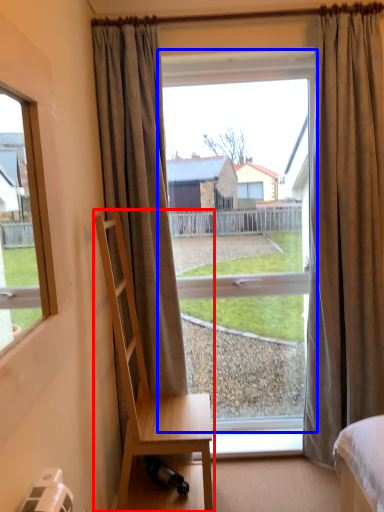
Question: Which point is further to the camera, chair (highlighted by a red box) or window (highlighted by a blue box)?

Choices:
 (A) chair
 (B) window

Answer: (B)